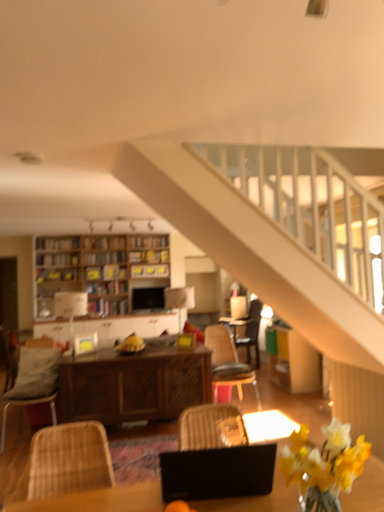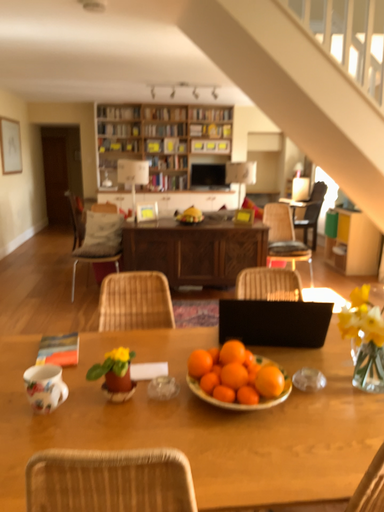
Question: How did the camera likely rotate when shooting the video?

Choices:
 (A) rotated left
 (B) rotated right

Answer: (A)